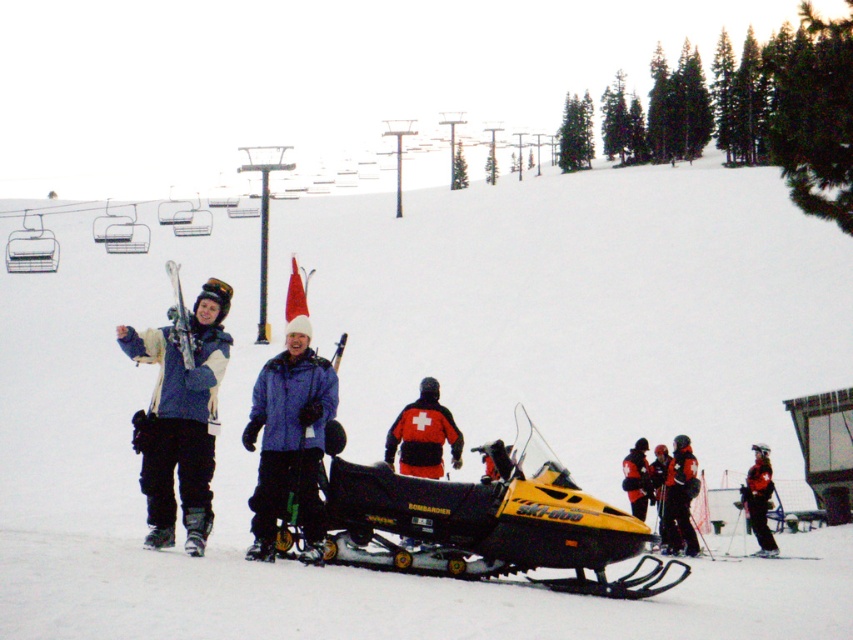
How far apart are yellow matte snowmobile at center and black ski pants at center?

A distance of 15.84 meters exists between yellow matte snowmobile at center and black ski pants at center.

Based on the photo, which is more to the right, yellow matte snowmobile at center or black ski pants at center?

Positioned to the right is black ski pants at center.

Between point (498, 461) and point (677, 484), which one is positioned in front?

Point (498, 461) is more forward.

The width and height of the screenshot is (853, 640). I want to click on yellow matte snowmobile at center, so click(490, 522).

Is blue matte jacket at center to the left of black ski pants at center from the viewer's perspective?

Correct, you'll find blue matte jacket at center to the left of black ski pants at center.

Does point (325, 364) come in front of point (682, 513)?

Yes.

Identify the location of blue matte jacket at center. This screenshot has width=853, height=640. (289, 440).

Is matte blue jacket at left taller than black matte jacket at center?

Indeed, matte blue jacket at left has a greater height compared to black matte jacket at center.

Does point (207, 282) lie in front of point (401, 428)?

Yes.

Who is more forward, (x=166, y=403) or (x=407, y=429)?

Point (x=166, y=403) is more forward.

What are the coordinates of `matte blue jacket at left` in the screenshot? It's located at (180, 416).